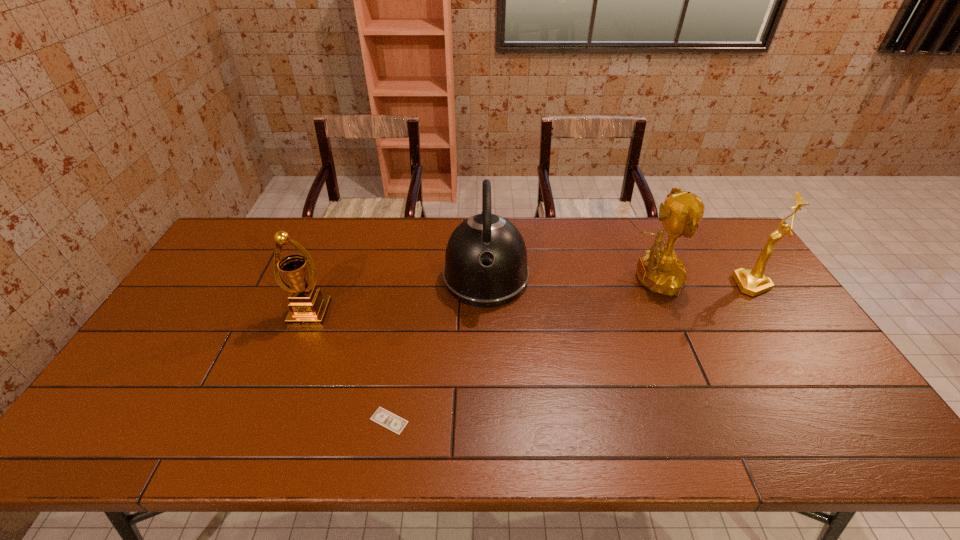
Image resolution: width=960 pixels, height=540 pixels. In order to click on kettle in this screenshot , I will do `click(485, 266)`.

Locate an element on the screen. The width and height of the screenshot is (960, 540). the second award from right to left is located at coordinates (661, 271).

The height and width of the screenshot is (540, 960). Identify the location of the rightmost award. (753, 282).

Where is `the leftmost award`? The height and width of the screenshot is (540, 960). the leftmost award is located at coordinates (308, 307).

What are the coordinates of `the nearest object` in the screenshot? It's located at (383, 417).

Identify the location of the shortest object. This screenshot has height=540, width=960. (383, 417).

This screenshot has width=960, height=540. In order to click on free space located 0.130m on the spout of the kettle in this screenshot , I will do `click(487, 348)`.

At what (x,y) coordinates should I click in order to perform the action: click on vacant space located 0.170m on the front side of the second award from right to left. Please return your answer as a coordinate pair (x, y). Looking at the image, I should click on (564, 279).

This screenshot has width=960, height=540. Find the location of `vacant area located on the front side of the second award from right to left`. vacant area located on the front side of the second award from right to left is located at coordinates (497, 279).

You are a GUI agent. You are given a task and a screenshot of the screen. Output one action in this format:
    pyautogui.click(x=<x>, y=<y>)
    Task: Click on the vacant space located on the front side of the second award from right to left
    The height and width of the screenshot is (540, 960).
    Given the screenshot: What is the action you would take?
    pyautogui.click(x=558, y=279)